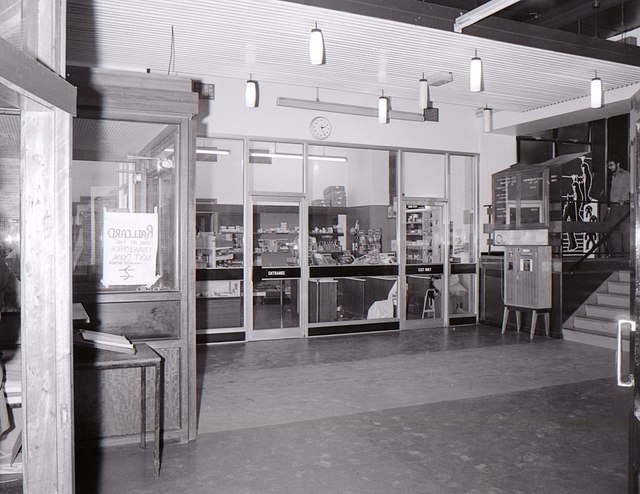
You are a GUI agent. You are given a task and a screenshot of the screen. Output one action in this format:
    pyautogui.click(x=<x>, y=<y>)
    Task: Click on the table leg
    
    Given the screenshot: What is the action you would take?
    pyautogui.click(x=141, y=380), pyautogui.click(x=160, y=384)